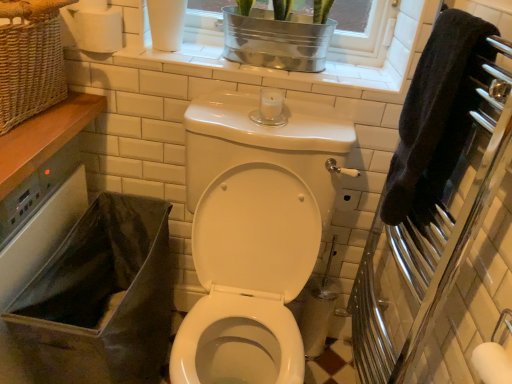
Question: Is black terry cloth towel at right wider than white matte toilet paper at upper left?

Choices:
 (A) no
 (B) yes

Answer: (A)

Question: Is black terry cloth towel at right to the left of white matte toilet paper at upper left from the viewer's perspective?

Choices:
 (A) yes
 (B) no

Answer: (B)

Question: Can you confirm if black terry cloth towel at right is smaller than white matte toilet paper at upper left?

Choices:
 (A) yes
 (B) no

Answer: (B)

Question: Does black terry cloth towel at right lie in front of white matte toilet paper at upper left?

Choices:
 (A) no
 (B) yes

Answer: (B)

Question: Would you consider black terry cloth towel at right to be distant from white matte toilet paper at upper left?

Choices:
 (A) no
 (B) yes

Answer: (A)

Question: From the image's perspective, does black terry cloth towel at right appear higher than white matte toilet paper at upper left?

Choices:
 (A) yes
 (B) no

Answer: (B)

Question: From a real-world perspective, is metallic silver window frame at upper center, marked as the second window frame in a left-to-right arrangement, located higher than white matte toilet paper at upper left?

Choices:
 (A) no
 (B) yes

Answer: (B)

Question: Is metallic silver window frame at upper center, marked as the second window frame in a left-to-right arrangement, oriented towards white matte toilet paper at upper left?

Choices:
 (A) yes
 (B) no

Answer: (B)

Question: Is the position of metallic silver window frame at upper center, arranged as the 1th window frame when viewed from the right, less distant than that of white matte toilet paper at upper left?

Choices:
 (A) no
 (B) yes

Answer: (A)

Question: Considering the relative sizes of metallic silver window frame at upper center, marked as the second window frame in a left-to-right arrangement, and white matte toilet paper at upper left in the image provided, is metallic silver window frame at upper center, marked as the second window frame in a left-to-right arrangement, bigger than white matte toilet paper at upper left?

Choices:
 (A) no
 (B) yes

Answer: (B)

Question: Is metallic silver window frame at upper center, arranged as the 1th window frame when viewed from the right, thinner than white matte toilet paper at upper left?

Choices:
 (A) yes
 (B) no

Answer: (B)

Question: From the image's perspective, is metallic silver window frame at upper center, arranged as the 1th window frame when viewed from the right, below white matte toilet paper at upper left?

Choices:
 (A) yes
 (B) no

Answer: (B)

Question: Is metallic silver window frame at upper center, arranged as the 1th window frame when viewed from the right, placed right next to black terry cloth towel at right?

Choices:
 (A) yes
 (B) no

Answer: (B)